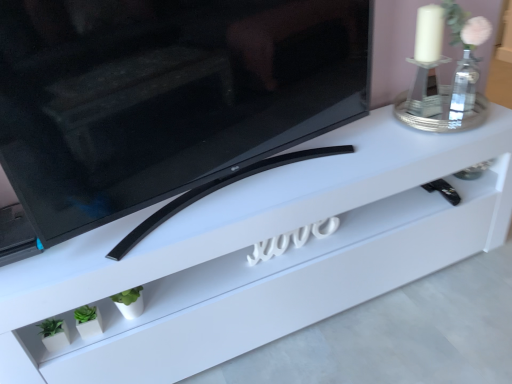
At what (x,y) coordinates should I click in order to perform the action: click on free space in front of white glass candle holder at upper right. Please return your answer as a coordinate pair (x, y). This screenshot has height=384, width=512. Looking at the image, I should click on point(464,134).